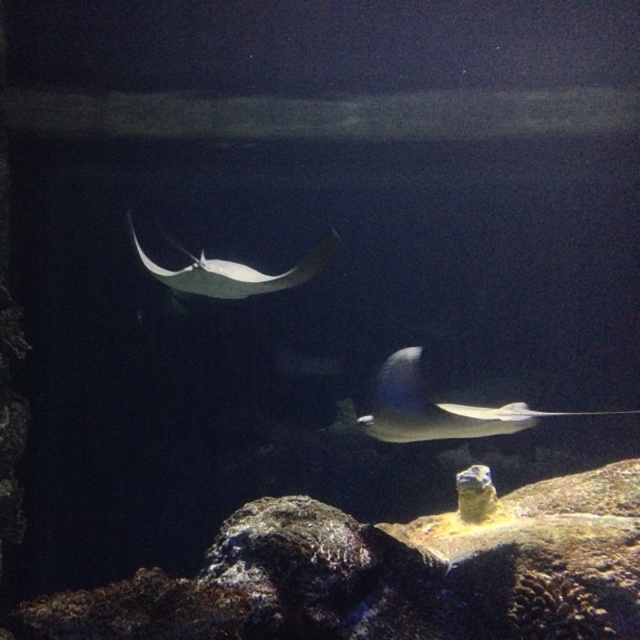
Who is higher up, glossy blue stingray at center or white glossy stingray at center?

white glossy stingray at center is above.

Can you confirm if glossy blue stingray at center is positioned above white glossy stingray at center?

No, glossy blue stingray at center is not above white glossy stingray at center.

I want to click on glossy blue stingray at center, so click(432, 408).